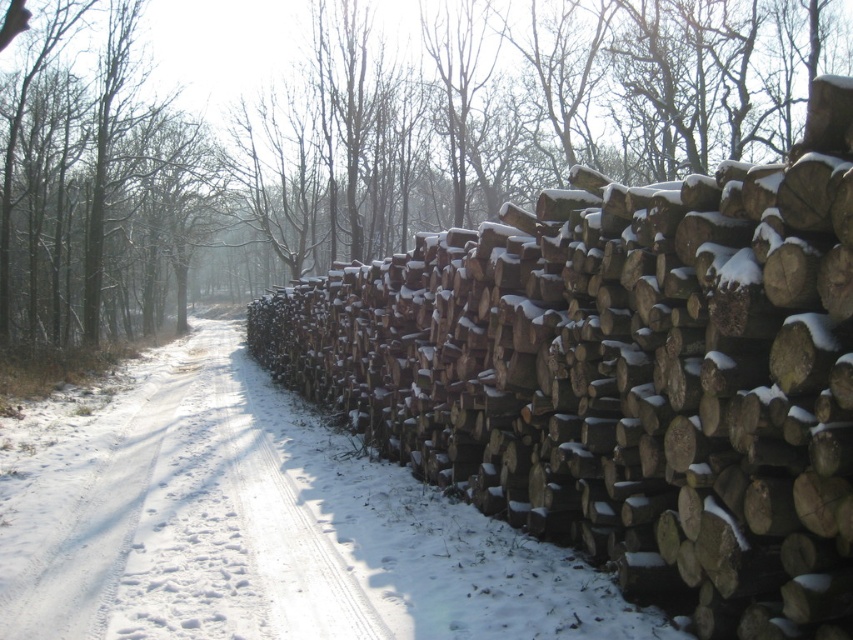
Question: Where is snow-covered wood at right located in relation to brown rough wood at right in the image?

Choices:
 (A) above
 (B) below

Answer: (B)

Question: Among these points, which one is nearest to the camera?

Choices:
 (A) (115, 236)
 (B) (503, 464)

Answer: (B)

Question: Which of the following is the farthest from the observer?

Choices:
 (A) brown rough wood at right
 (B) white powdery snow at right
 (C) smooth brown tree trunk at left

Answer: (A)

Question: Can you confirm if brown rough wood at right is positioned below white powdery snow at right?

Choices:
 (A) yes
 (B) no

Answer: (B)

Question: Is the position of snow-covered wood at right more distant than that of brown rough wood at right?

Choices:
 (A) yes
 (B) no

Answer: (B)

Question: Which of the following is the closest to the observer?

Choices:
 (A) (555, 250)
 (B) (775, 131)
 (C) (167, 168)
 (D) (288, 424)

Answer: (A)